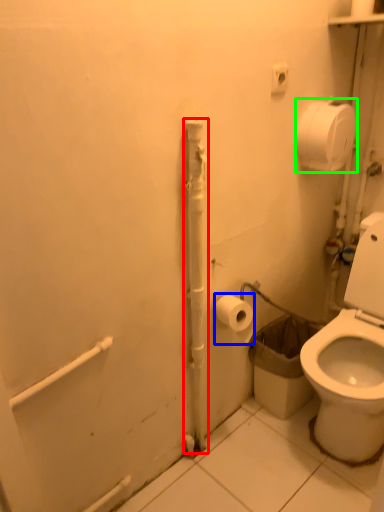
Question: Which object is positioned farthest from pipe (highlighted by a red box)? Select from toilet paper (highlighted by a blue box) and toilet paper (highlighted by a green box).

Choices:
 (A) toilet paper
 (B) toilet paper

Answer: (B)